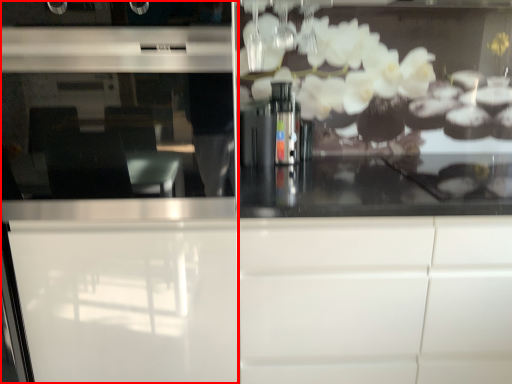
Question: Observing the image, what is the correct spatial positioning of screen door (annotated by the red box) in reference to cabinetry?

Choices:
 (A) left
 (B) right

Answer: (A)